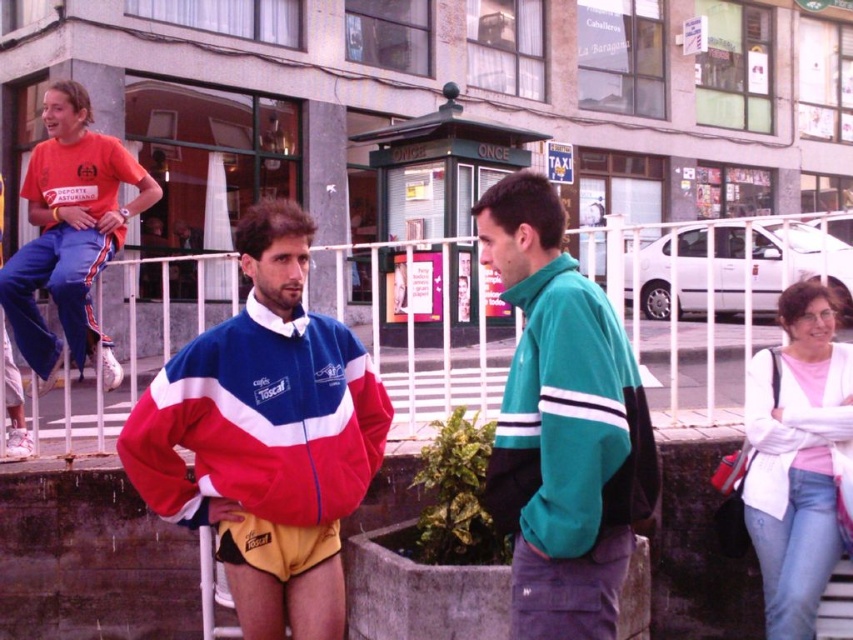
Where is the teal fleece jacket at center located in the image?

The teal fleece jacket at center is located at point coordinates of (561, 426).

You are standing at the point marked as point (706, 298). What object are you touching?

You are touching the white metal rail at upper center because the point (706, 298) is located on it.